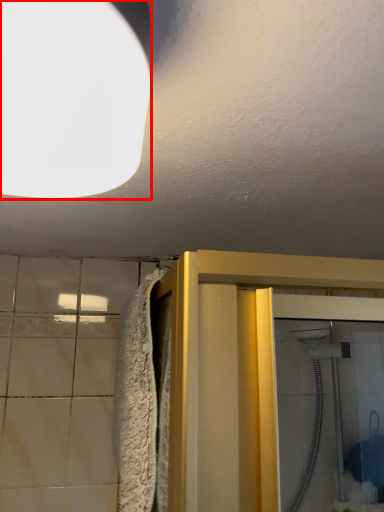
Question: Observing the image, what is the correct spatial positioning of lighting (annotated by the red box) in reference to bath towel?

Choices:
 (A) left
 (B) right

Answer: (A)